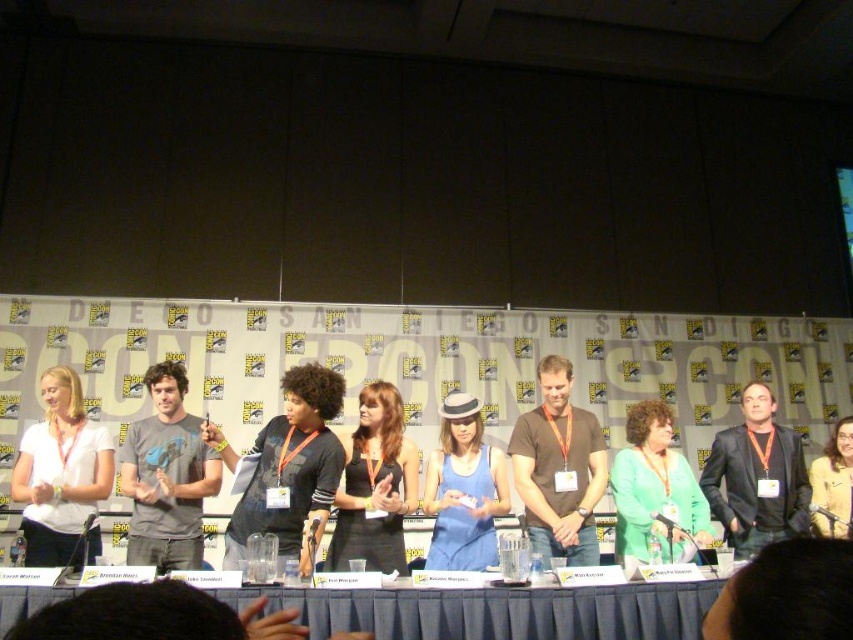
What do you see at coordinates (292, 470) in the screenshot?
I see `black cotton shirt at center` at bounding box center [292, 470].

Which of these two, black cotton shirt at center or black leather jacket at center, stands shorter?

Standing shorter between the two is black cotton shirt at center.

Locate an element on the screen. The height and width of the screenshot is (640, 853). black cotton shirt at center is located at coordinates (292, 470).

Who is positioned more to the right, brown cotton t-shirt at center or yellow fabric jacket at center?

Positioned to the right is yellow fabric jacket at center.

Which is behind, point (521, 470) or point (824, 468)?

The point (824, 468) is more distant.

The height and width of the screenshot is (640, 853). What are the coordinates of `brown cotton t-shirt at center` in the screenshot? It's located at (558, 468).

Can you confirm if blue fabric table at center is positioned to the left of brown cotton t-shirt at center?

Indeed, blue fabric table at center is positioned on the left side of brown cotton t-shirt at center.

Is blue fabric table at center taller than brown cotton t-shirt at center?

No.

Does point (695, 602) come in front of point (544, 528)?

Yes, point (695, 602) is in front of point (544, 528).

You are a GUI agent. You are given a task and a screenshot of the screen. Output one action in this format:
    pyautogui.click(x=<x>, y=<y>)
    Task: Click on the blue fabric table at center
    
    Given the screenshot: What is the action you would take?
    pyautogui.click(x=495, y=611)